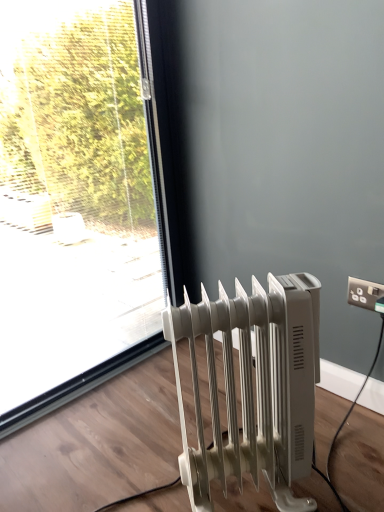
Question: Considering the relative sizes of white plastic radiator at lower right and transparent glass window at upper left in the image provided, is white plastic radiator at lower right bigger than transparent glass window at upper left?

Choices:
 (A) yes
 (B) no

Answer: (B)

Question: Can you confirm if white plastic radiator at lower right is smaller than transparent glass window at upper left?

Choices:
 (A) yes
 (B) no

Answer: (A)

Question: From a real-world perspective, is white plastic radiator at lower right physically above transparent glass window at upper left?

Choices:
 (A) no
 (B) yes

Answer: (A)

Question: Does white plastic radiator at lower right come in front of transparent glass window at upper left?

Choices:
 (A) no
 (B) yes

Answer: (B)

Question: Would you say white plastic radiator at lower right is outside transparent glass window at upper left?

Choices:
 (A) no
 (B) yes

Answer: (B)

Question: Considering the positions of white plastic radiator at lower right and transparent glass window at upper left in the image, is white plastic radiator at lower right wider or thinner than transparent glass window at upper left?

Choices:
 (A) thin
 (B) wide

Answer: (B)

Question: Relative to transparent glass window at upper left, is white plastic radiator at lower right in front or behind?

Choices:
 (A) behind
 (B) front

Answer: (B)

Question: In the image, is white plastic radiator at lower right on the left side or the right side of transparent glass window at upper left?

Choices:
 (A) left
 (B) right

Answer: (B)

Question: Would you say white plastic radiator at lower right is inside or outside transparent glass window at upper left?

Choices:
 (A) inside
 (B) outside

Answer: (B)

Question: Is transparent glass window at upper left inside or outside of white plastic radiator at lower right?

Choices:
 (A) outside
 (B) inside

Answer: (A)

Question: Is transparent glass window at upper left taller or shorter than white plastic radiator at lower right?

Choices:
 (A) short
 (B) tall

Answer: (B)

Question: Would you say transparent glass window at upper left is to the left or to the right of white plastic radiator at lower right in the picture?

Choices:
 (A) left
 (B) right

Answer: (A)

Question: Looking at the image, does transparent glass window at upper left seem bigger or smaller compared to white plastic radiator at lower right?

Choices:
 (A) small
 (B) big

Answer: (B)

Question: Is point (367, 303) closer or farther from the camera than point (226, 302)?

Choices:
 (A) closer
 (B) farther

Answer: (B)

Question: Is white plastic electrical outlet at upper right spatially inside white plastic radiator at lower right, or outside of it?

Choices:
 (A) inside
 (B) outside

Answer: (B)